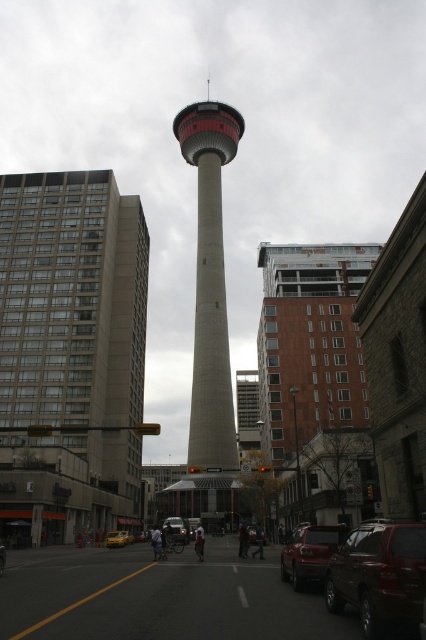
You are a pedestrian standing at the base of the Calgary Tower and see both the shiny black car at center and the yellow matte car at center. Which car is directly above the other?

The shiny black car at center is positioned under the yellow matte car at center, so the yellow matte car at center is directly above the shiny black car at center.

You are a drone operator who needs to fly a drone from the concrete tower at center to the yellow matte car at center. Given that the drone has a maximum flight range of 60 meters, will it be able to reach the car without needing to recharge?

The concrete tower at center and yellow matte car at center are 61.71 meters apart from each other. Since the drone can only fly up to 60 meters without recharging, it will not be able to reach the car without needing to recharge.